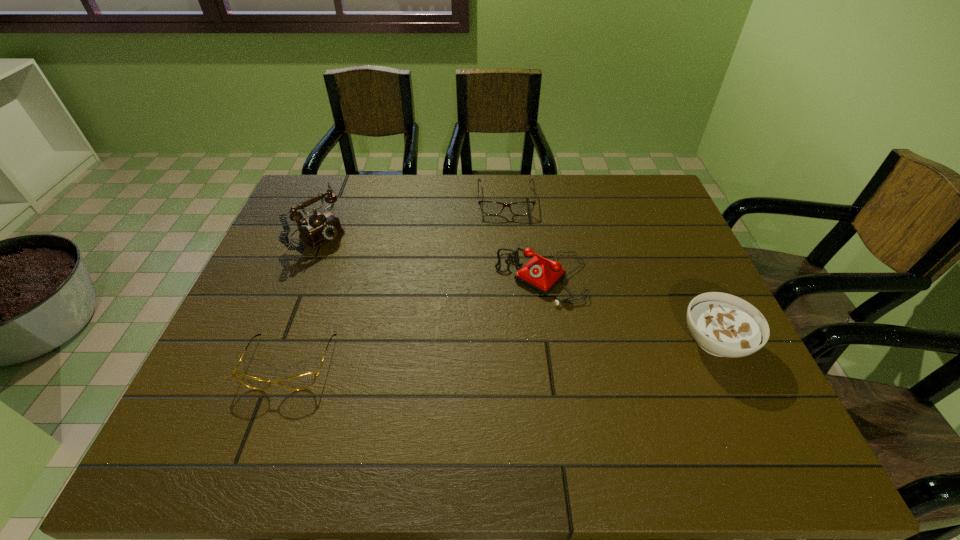
Locate an element on the screen. The width and height of the screenshot is (960, 540). vacant region between the right spectacles and the tallest object is located at coordinates (415, 208).

Locate an element on the screen. vacant space that is in between the tallest object and the shorter telephone is located at coordinates (433, 247).

The image size is (960, 540). I want to click on unoccupied position between the shorter telephone and the soup bowl, so click(x=628, y=309).

You are a GUI agent. You are given a task and a screenshot of the screen. Output one action in this format:
    pyautogui.click(x=<x>, y=<y>)
    Task: Click on the vacant region between the right telephone and the soup bowl
    The image size is (960, 540).
    Given the screenshot: What is the action you would take?
    pyautogui.click(x=628, y=309)

At what (x,y) coordinates should I click in order to perform the action: click on vacant space that is in between the nearer spectacles and the farther spectacles. Please return your answer as a coordinate pair (x, y). The height and width of the screenshot is (540, 960). Looking at the image, I should click on (397, 281).

You are a GUI agent. You are given a task and a screenshot of the screen. Output one action in this format:
    pyautogui.click(x=<x>, y=<y>)
    Task: Click on the free space between the nearer spectacles and the shorter telephone
    The image size is (960, 540).
    Given the screenshot: What is the action you would take?
    pyautogui.click(x=416, y=320)

Find the location of `free space between the farther spectacles and the shorter telephone`. free space between the farther spectacles and the shorter telephone is located at coordinates (523, 239).

Where is `vacant area that lies between the taller telephone and the shorter telephone`? This screenshot has height=540, width=960. vacant area that lies between the taller telephone and the shorter telephone is located at coordinates (433, 247).

The image size is (960, 540). I want to click on free spot between the taller telephone and the left spectacles, so click(x=307, y=289).

Where is `free space between the soup bowl and the right spectacles`? The width and height of the screenshot is (960, 540). free space between the soup bowl and the right spectacles is located at coordinates (611, 271).